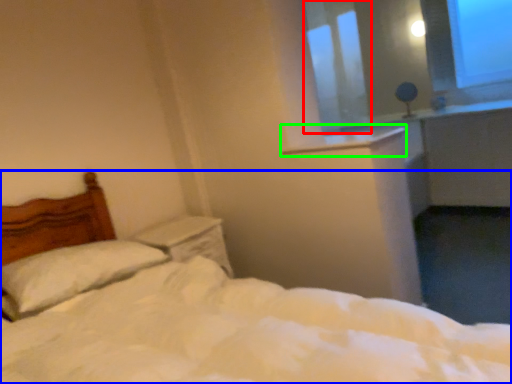
Question: Which object is positioned farthest from window screen (highlighted by a red box)? Select from bed (highlighted by a blue box) and window sill (highlighted by a green box).

Choices:
 (A) bed
 (B) window sill

Answer: (A)